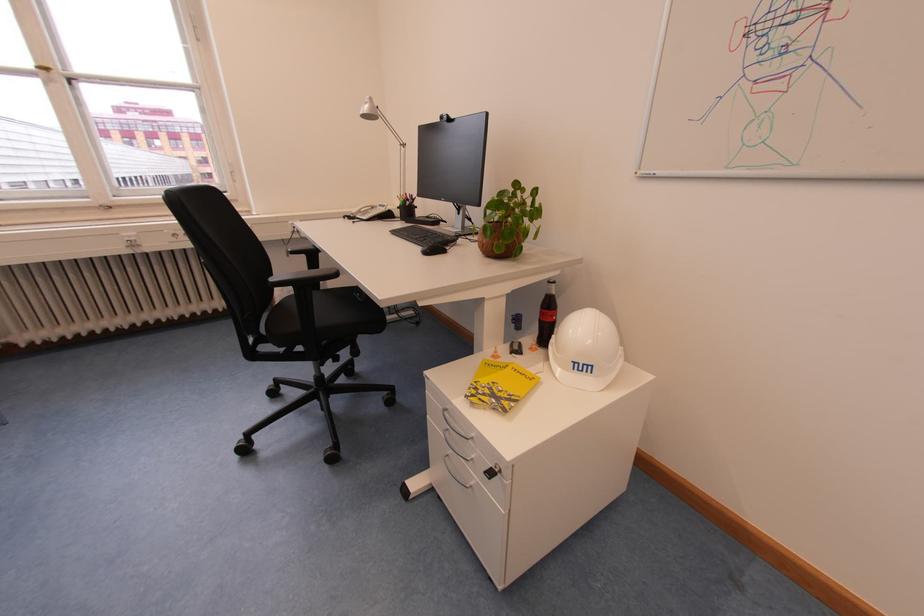
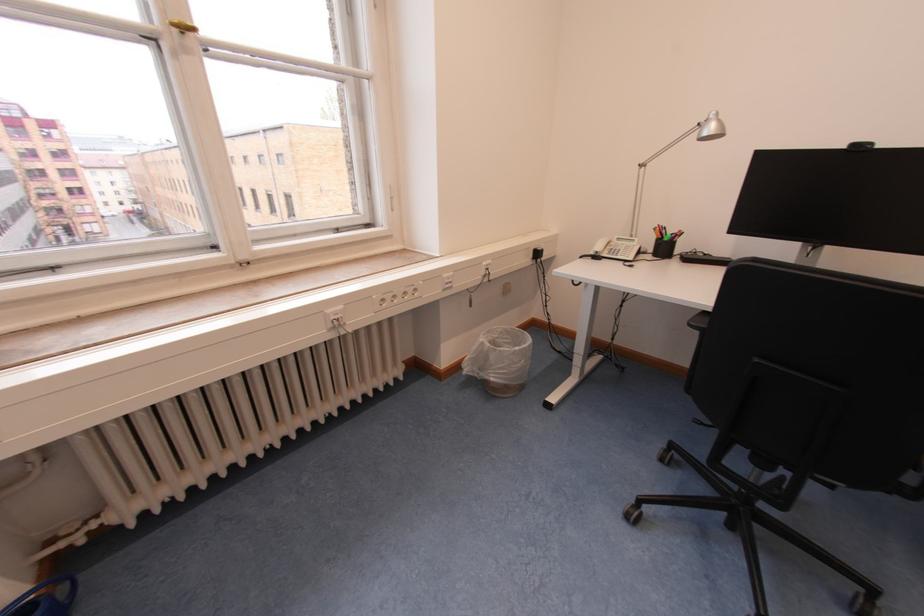
Find the pixel in the second image that matches point 372,111 in the first image.

(719, 130)